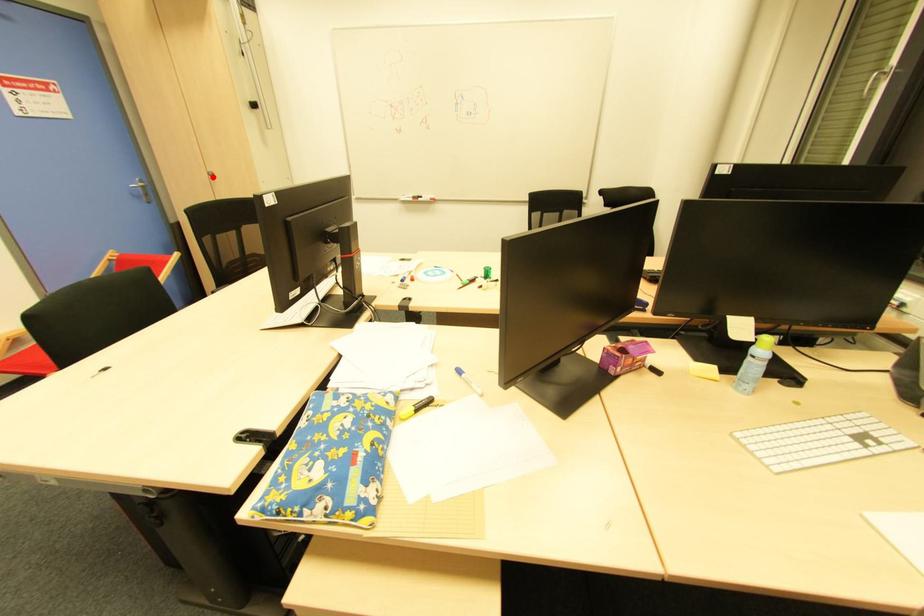
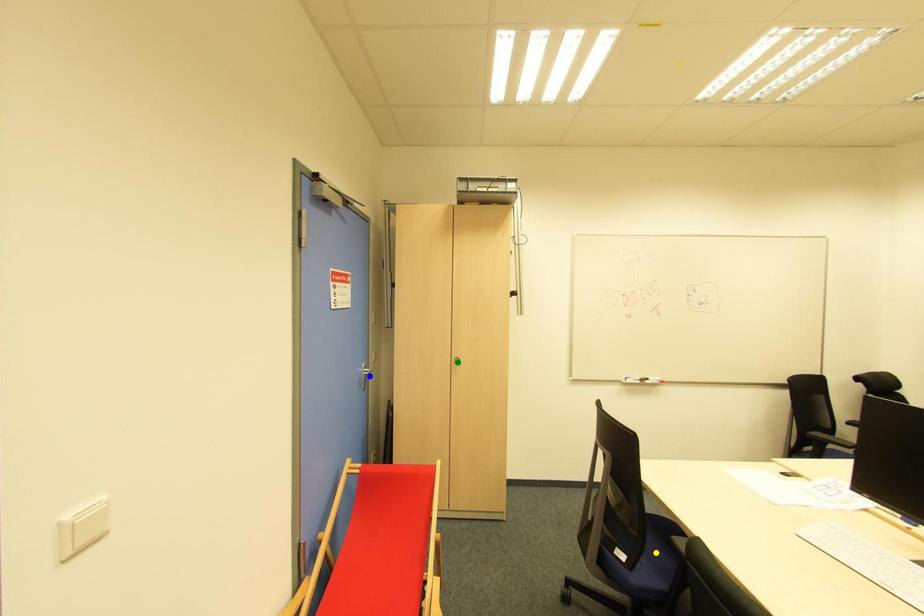
Question: I am providing you with two images of the same scene from different viewpoints. A red point is marked on the first image. You are given multiple points on the second image. Can you choose the point in image 2 that corresponds to the point in image 1?

Choices:
 (A) green point
 (B) yellow point
 (C) blue point

Answer: (A)